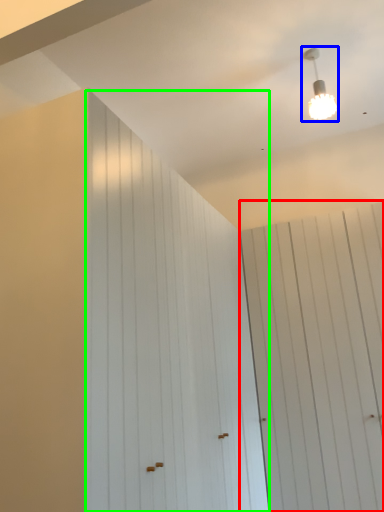
Question: Estimate the real-world distances between objects in this image. Which object is closer to barn door (highlighted by a red box), lamp (highlighted by a blue box) or barn door (highlighted by a green box)?

Choices:
 (A) lamp
 (B) barn door

Answer: (B)